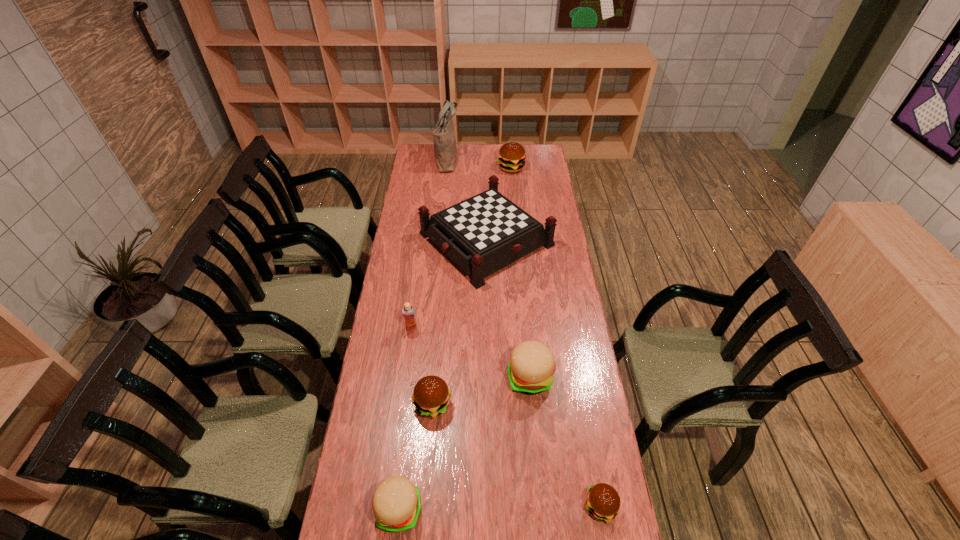
I want to click on free space located on the right of the second biggest brown hamburger, so click(533, 404).

Identify the location of vacant space located 0.180m on the back of the smaller beige hamburger. The image size is (960, 540). (408, 428).

This screenshot has height=540, width=960. Identify the location of vacant space located on the left of the rightmost brown hamburger. (528, 507).

Identify the location of shoulder bag situated at the far edge. (445, 151).

Identify the location of hamburger that is at the far edge. The height and width of the screenshot is (540, 960). (511, 157).

I want to click on shoulder bag present at the left edge, so click(445, 151).

At what (x,y) coordinates should I click in order to perform the action: click on checkerboard that is at the left edge. Please return your answer as a coordinate pair (x, y). Looking at the image, I should click on (483, 234).

You are a GUI agent. You are given a task and a screenshot of the screen. Output one action in this format:
    pyautogui.click(x=<x>, y=<y>)
    Task: Click on the orange juice that is positioned at the left edge
    The width and height of the screenshot is (960, 540).
    Given the screenshot: What is the action you would take?
    408,311

You are a GUI agent. You are given a task and a screenshot of the screen. Output one action in this format:
    pyautogui.click(x=<x>, y=<y>)
    Task: Click on the hamburger that is at the left edge
    This screenshot has height=540, width=960.
    Given the screenshot: What is the action you would take?
    pyautogui.click(x=396, y=501)

Identify the location of checkerboard at the right edge. This screenshot has width=960, height=540. (483, 234).